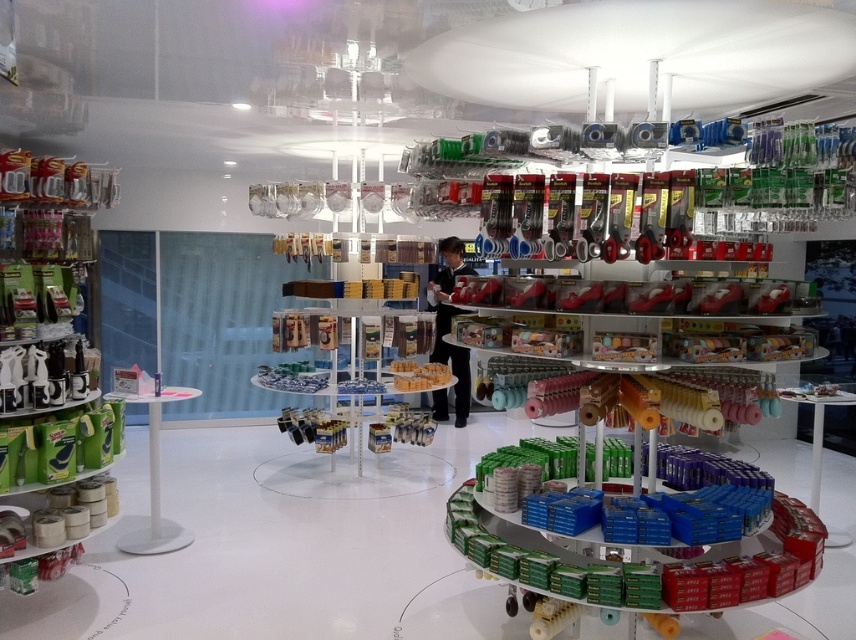
Question: Which object is farther from the camera taking this photo?

Choices:
 (A) clear plastic shelf at center
 (B) green matte tape at left

Answer: (A)

Question: Does green matte tape at left lie in front of clear plastic shelf at center?

Choices:
 (A) yes
 (B) no

Answer: (A)

Question: Which of the following is the farthest from the observer?

Choices:
 (A) (385, 390)
 (B) (36, 365)

Answer: (A)

Question: Is green matte tape at left in front of clear plastic shelf at center?

Choices:
 (A) yes
 (B) no

Answer: (A)

Question: Is green matte tape at left closer to the viewer compared to clear plastic shelf at center?

Choices:
 (A) no
 (B) yes

Answer: (B)

Question: Which point appears closest to the camera in this image?

Choices:
 (A) (100, 186)
 (B) (276, 387)

Answer: (A)